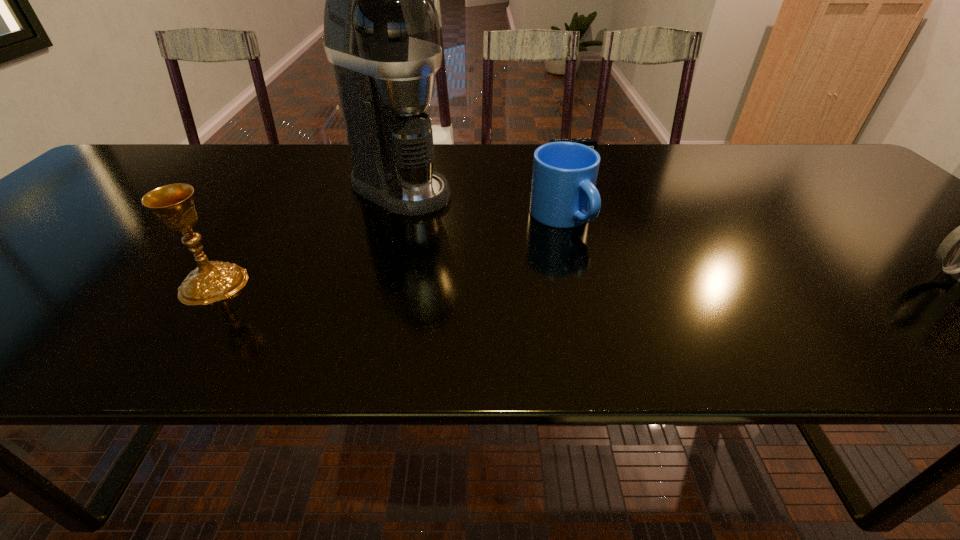
At what (x,y) coordinates should I click in order to perform the action: click on vacant space located on the side of the left mug with the handle. Please return your answer as a coordinate pair (x, y). The image size is (960, 540). Looking at the image, I should click on (668, 313).

Find the location of `vacant space located 0.210m on the side of the left mug with the handle`. vacant space located 0.210m on the side of the left mug with the handle is located at coordinates (649, 296).

Locate an element on the screen. The width and height of the screenshot is (960, 540). vacant region located on the side of the left mug with the handle is located at coordinates (620, 272).

Where is `vacant space situated place cup under the spout of the coffee maker`? vacant space situated place cup under the spout of the coffee maker is located at coordinates (543, 260).

Locate an element on the screen. This screenshot has height=540, width=960. free space located 0.320m place cup under the spout of the coffee maker is located at coordinates (543, 260).

I want to click on vacant space located place cup under the spout of the coffee maker, so [506, 241].

Where is `alarm clock positioned at the far edge`? alarm clock positioned at the far edge is located at coordinates (591, 142).

Where is `coffee maker situated at the far edge`? Image resolution: width=960 pixels, height=540 pixels. coffee maker situated at the far edge is located at coordinates (381, 29).

You are a GUI agent. You are given a task and a screenshot of the screen. Output one action in this format:
    pyautogui.click(x=<x>, y=<y>)
    Task: Click on the object located in the near edge section of the desktop
    
    Given the screenshot: What is the action you would take?
    pyautogui.click(x=211, y=281)

At what (x,y) coordinates should I click in order to perform the action: click on vacant space at the far edge of the desktop. Please return your answer as a coordinate pair (x, y). Looking at the image, I should click on (686, 154).